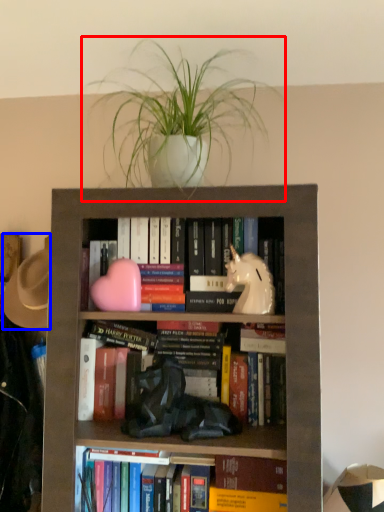
Question: Which point is closer to the camera, houseplant (highlighted by a red box) or hat (highlighted by a blue box)?

Choices:
 (A) houseplant
 (B) hat

Answer: (A)